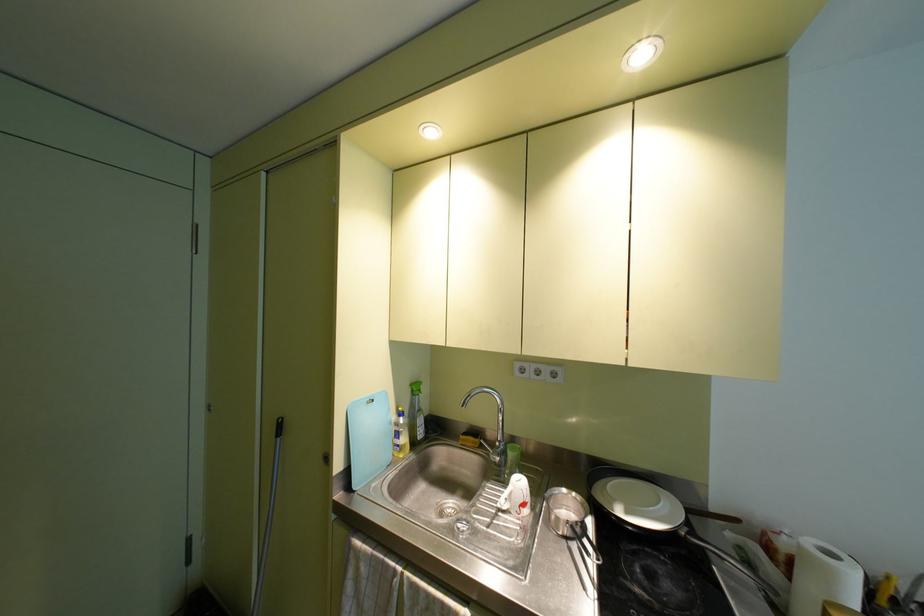
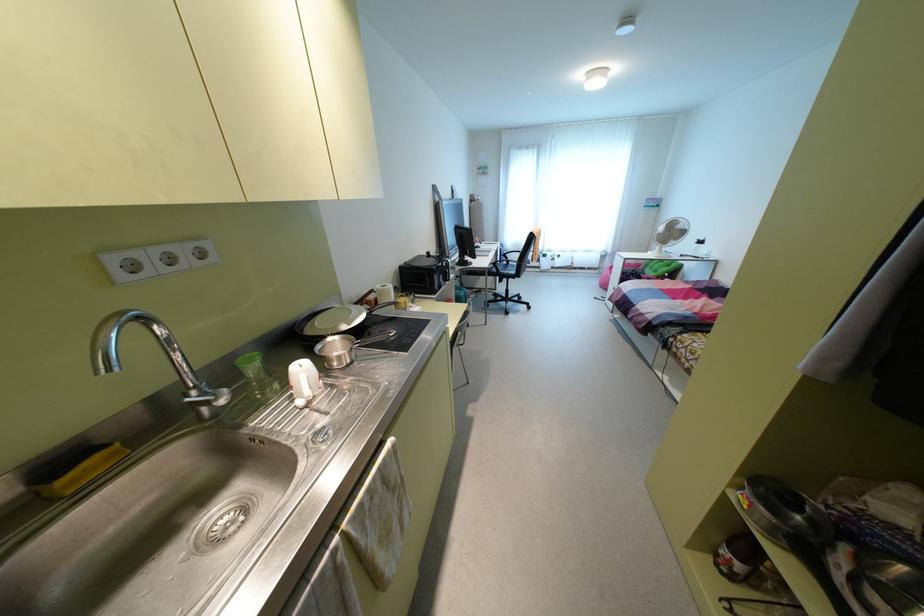
In the second image, find the point that corresponds to point (459, 436) in the first image.

(59, 482)